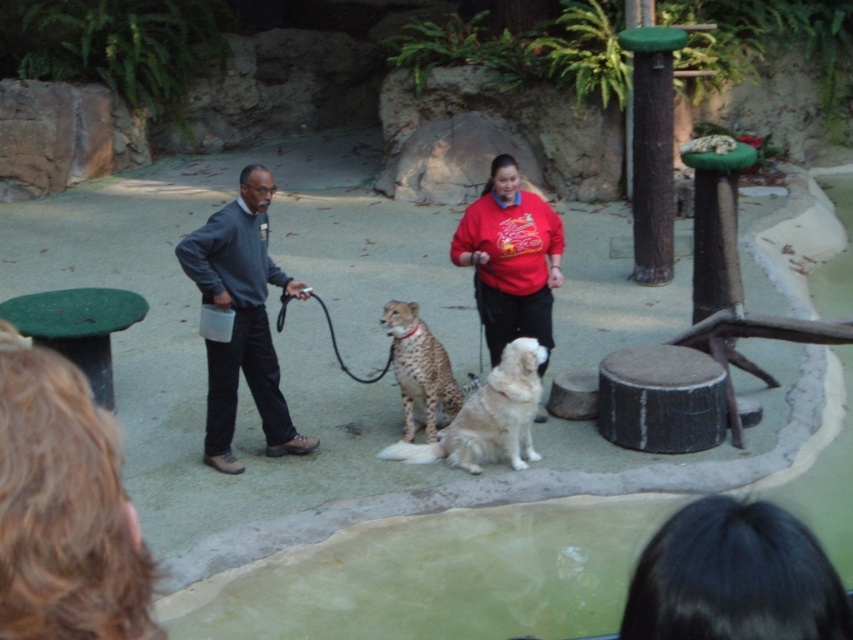
Question: Can you confirm if dark gray sweater at left is positioned above white fluffy dog at center?

Choices:
 (A) no
 (B) yes

Answer: (B)

Question: Can you confirm if dark gray sweater at left is positioned to the left of spotted fur cheetah at center?

Choices:
 (A) yes
 (B) no

Answer: (A)

Question: Which of the following is the farthest from the observer?

Choices:
 (A) white fluffy dog at center
 (B) spotted fur cheetah at center
 (C) dark gray sweater at left
 (D) red cotton shirt at center

Answer: (B)

Question: Which object is positioned farthest from the dark gray sweater at left?

Choices:
 (A) red cotton shirt at center
 (B) spotted fur cheetah at center

Answer: (A)

Question: Which object is closer to the camera taking this photo?

Choices:
 (A) red cotton shirt at center
 (B) white fluffy dog at center
 (C) dark gray sweater at left

Answer: (C)

Question: Observing the image, what is the correct spatial positioning of white fluffy dog at center in reference to spotted fur cheetah at center?

Choices:
 (A) right
 (B) left

Answer: (A)